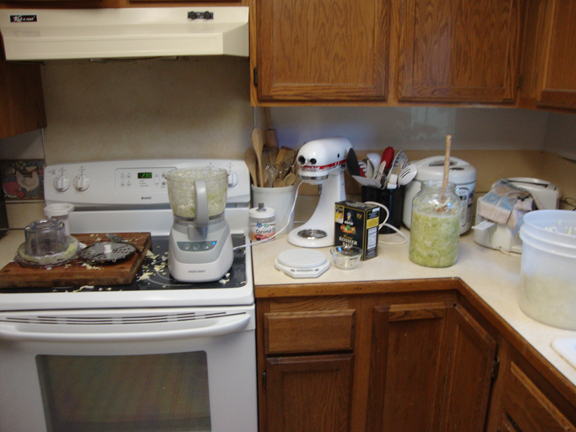
Locate an element on the screen. insta-pot is located at coordinates (466, 174).